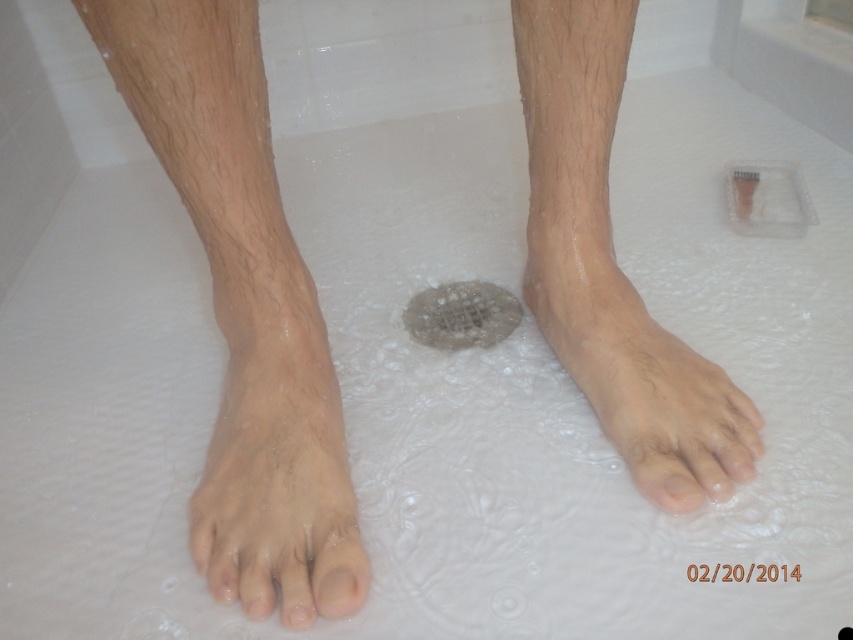
You are a bathroom cleaner and need to locate the dry skin at lower center in the shower. According to the coordinates provided, where exactly should you look to find it?

The dry skin at lower center is located at coordinates point (612,268).